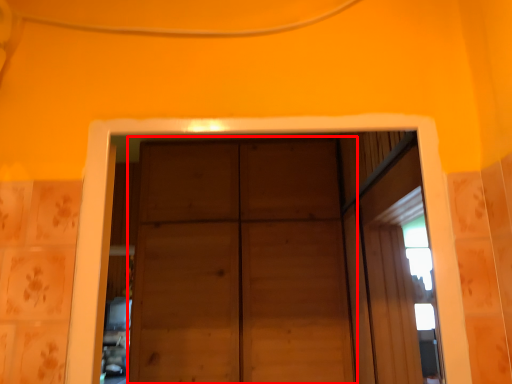
Question: Considering the relative positions of door (annotated by the red box) and window in the image provided, where is door (annotated by the red box) located with respect to the staircase?

Choices:
 (A) left
 (B) right

Answer: (A)